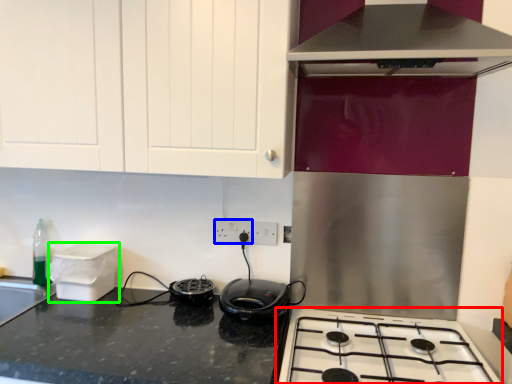
Question: Which object is positioned farthest from gas stove (highlighted by a red box)? Select from electric outlet (highlighted by a blue box) and appliance (highlighted by a green box).

Choices:
 (A) electric outlet
 (B) appliance

Answer: (B)